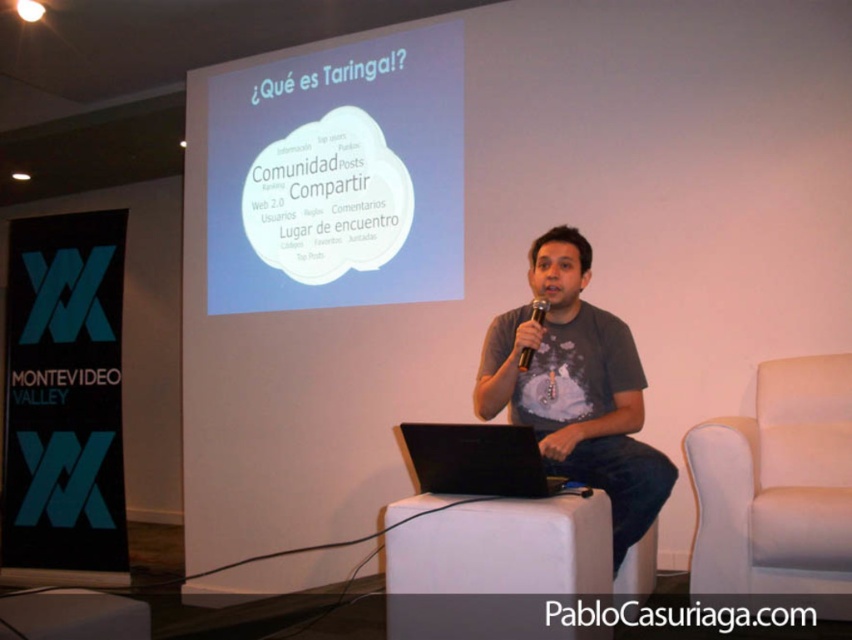
Question: Is black paper at left smaller than gray cotton t-shirt at center?

Choices:
 (A) yes
 (B) no

Answer: (B)

Question: Does gray cotton t-shirt at center appear on the right side of black matte laptop at center?

Choices:
 (A) no
 (B) yes

Answer: (B)

Question: Which point is closer to the camera?

Choices:
 (A) black paper at left
 (B) white cloud at center
 (C) white leather armchair at right
 (D) gray cotton t-shirt at center

Answer: (D)

Question: Which object appears closest to the camera in this image?

Choices:
 (A) white cloud at center
 (B) black plastic microphone at center
 (C) black paper at left
 (D) black matte laptop at center

Answer: (D)

Question: Does white cloud at center come in front of black plastic microphone at center?

Choices:
 (A) yes
 (B) no

Answer: (B)

Question: Among these objects, which one is nearest to the camera?

Choices:
 (A) gray cotton t-shirt at center
 (B) black plastic microphone at center

Answer: (A)